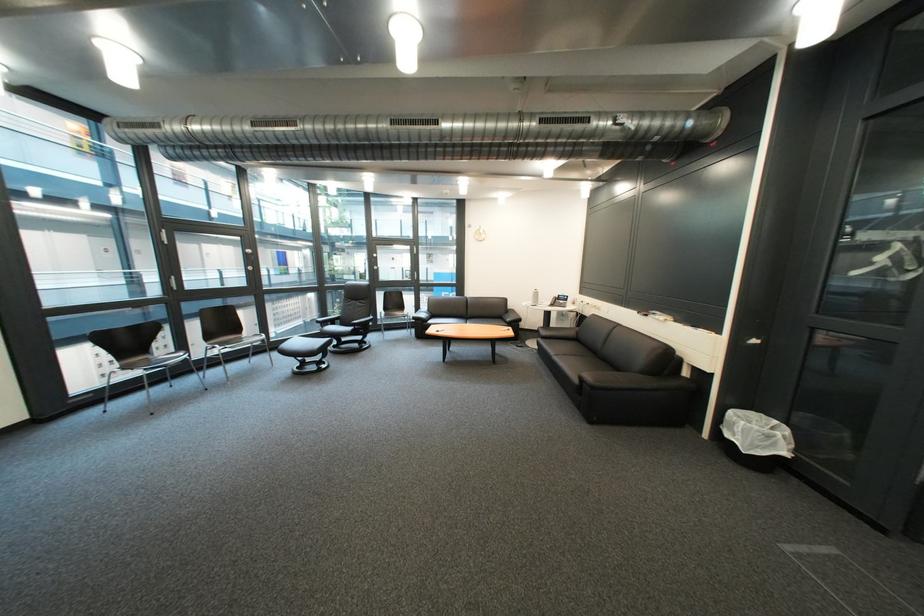
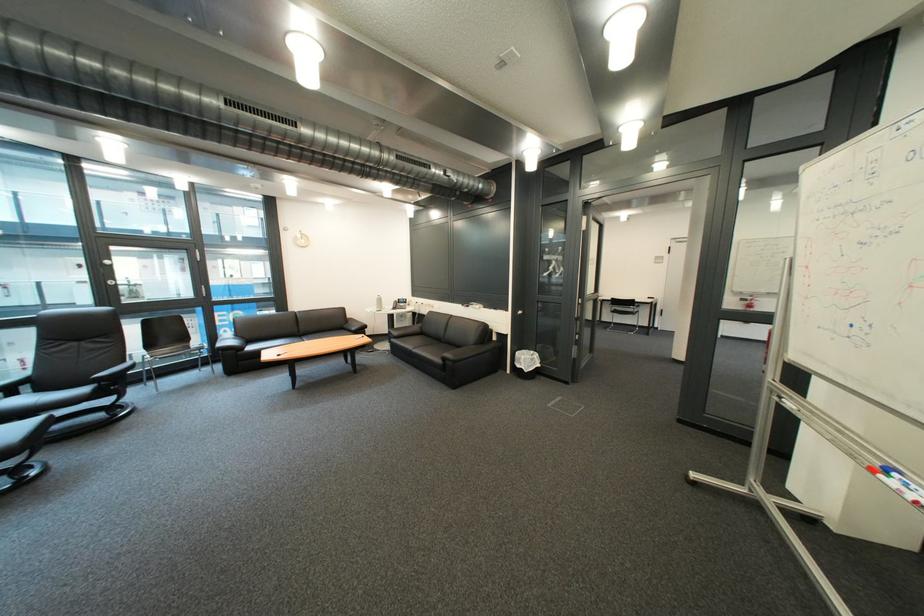
In the second image, find the point that corresponds to [343,325] in the first image.

(16, 395)